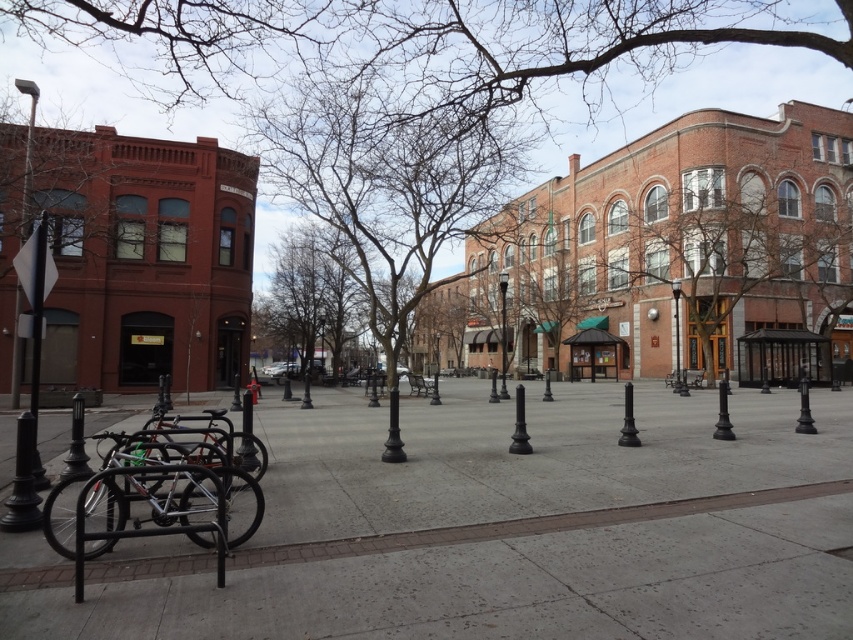
You are a city planner assessing the plaza for safety. You need to install a new security camera on the tallest object in the plaza. Which object should you choose between the bare branches at center and the silver metallic lamp post at center?

The bare branches at center is much taller than the silver metallic lamp post at center, so you should install the security camera on the bare branches at center.

You are standing in the plaza and want to walk towards the silver metallic lamp post at center and the polished metal lamp post at center. Which lamp post will you reach first?

The silver metallic lamp post at center is closer to you than the polished metal lamp post at center, so you will reach the silver metallic lamp post at center first.